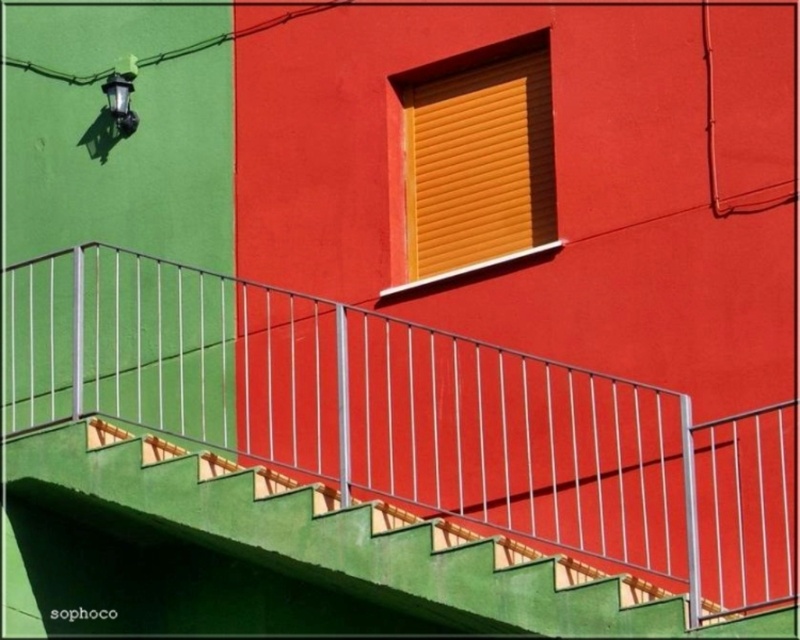
Who is taller, orange matte shutter at upper center or metallic black lamp at upper left?

orange matte shutter at upper center is taller.

Does point (474, 84) come in front of point (130, 58)?

That is True.

Locate an element on the screen. This screenshot has height=640, width=800. orange matte shutter at upper center is located at coordinates [x=476, y=161].

Does metallic silver railing at center appear over metallic black lamp at upper left?

Actually, metallic silver railing at center is below metallic black lamp at upper left.

Does metallic silver railing at center lie behind metallic black lamp at upper left?

No, metallic silver railing at center is closer to the viewer.

You are a GUI agent. You are given a task and a screenshot of the screen. Output one action in this format:
    pyautogui.click(x=<x>, y=<y>)
    Task: Click on the metallic silver railing at center
    The height and width of the screenshot is (640, 800).
    Given the screenshot: What is the action you would take?
    pyautogui.click(x=408, y=419)

You are a GUI agent. You are given a task and a screenshot of the screen. Output one action in this format:
    pyautogui.click(x=<x>, y=<y>)
    Task: Click on the metallic silver railing at center
    The height and width of the screenshot is (640, 800).
    Given the screenshot: What is the action you would take?
    pyautogui.click(x=408, y=419)

Who is more forward, (x=52, y=360) or (x=544, y=40)?

Point (x=544, y=40)

Between metallic silver railing at center and orange matte shutter at upper center, which one is positioned higher?

Positioned higher is orange matte shutter at upper center.

Is point (701, 602) less distant than point (433, 156)?

Yes.

Identify the location of metallic silver railing at center. (408, 419).